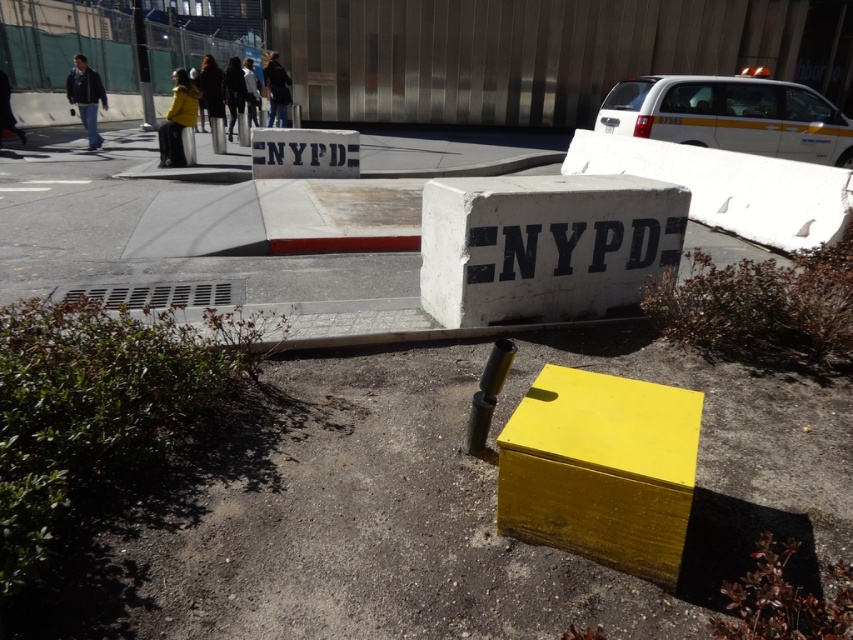
You are a photographer trying to capture both points in your shot. Which point, point (590,531) or point (77,96), appears larger in your photo?

Point (590,531) appears larger in the photo because it is closer to the camera than point (77,96).

You are standing at the origin point in the urban scene. There are two points marked as point 1 at coordinates (173, 154) and point 2 at coordinates (247, 60). Which point is closer to you?

Point 1 at coordinates (173, 154) is closer to you because it is in front of point 2 at coordinates (247, 60).